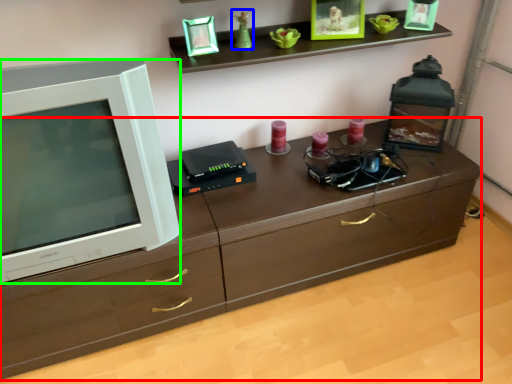
Question: Estimate the real-world distances between objects in this image. Which object is closer to chest of drawers (highlighted by a red box), toy (highlighted by a blue box) or television (highlighted by a green box)?

Choices:
 (A) toy
 (B) television

Answer: (B)